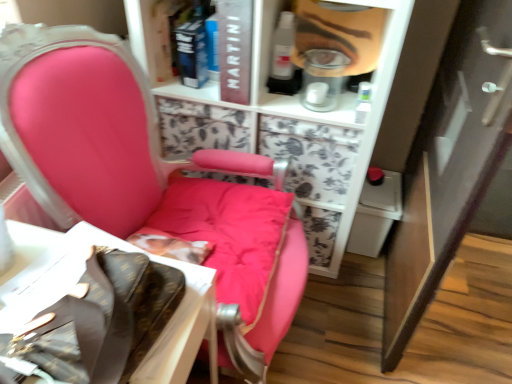
Based on the photo, in order to face hardcover book at upper center, the 2th book viewed from the right, should I rotate leftwards or rightwards?

You should rotate left by 6.574 degrees.

Describe the element at coordinates (449, 164) in the screenshot. I see `matte white cabinet at right` at that location.

Where is `white cardboard box at lower left`? This screenshot has width=512, height=384. white cardboard box at lower left is located at coordinates (103, 308).

In order to face matte pink chair at center, should I rotate leftwards or rightwards?

Turn left approximately 10.001 degrees to face it.

Locate an element on the screen. The width and height of the screenshot is (512, 384). matte pink chair at center is located at coordinates (93, 129).

In order to face matte black book at upper center, which appears as the 1th book when viewed from the right, should I rotate leftwards or rightwards?

Rotate your view left by about 1.300°.

Locate an element on the screen. The height and width of the screenshot is (384, 512). hardcover book at upper center, which is the first book from left to right is located at coordinates (192, 55).

Considering the sizes of objects white cardboard box at lower left and hardcover book at upper center, the 2th book viewed from the right, in the image provided, who is thinner, white cardboard box at lower left or hardcover book at upper center, the 2th book viewed from the right,?

hardcover book at upper center, the 2th book viewed from the right, is thinner.

Can you tell me how much white cardboard box at lower left and hardcover book at upper center, the 2th book viewed from the right, differ in facing direction?

91 degrees separate the facing orientations of white cardboard box at lower left and hardcover book at upper center, the 2th book viewed from the right.

Is white cardboard box at lower left positioned beyond the bounds of hardcover book at upper center, the 2th book viewed from the right?

Yes.

Considering the relative positions of white cardboard box at lower left and hardcover book at upper center, the 2th book viewed from the right, in the image provided, is white cardboard box at lower left to the left of hardcover book at upper center, the 2th book viewed from the right, from the viewer's perspective?

Yes.

From the image's perspective, count 1st books upward from the matte pink chair at center and point to it. Please provide its 2D coordinates.

[(234, 49)]

Does matte pink chair at center lie behind matte black book at upper center, which appears as the 1th book when viewed from the right?

No, the depth of matte pink chair at center is less than that of matte black book at upper center, which appears as the 1th book when viewed from the right.

From the image's perspective, would you say matte pink chair at center is shown under matte black book at upper center, which is the second book in left-to-right order?

Indeed, from the image's perspective, matte pink chair at center is shown beneath matte black book at upper center, which is the second book in left-to-right order.

Is matte pink chair at center bigger or smaller than matte black book at upper center, which is the second book in left-to-right order?

Clearly, matte pink chair at center is larger in size than matte black book at upper center, which is the second book in left-to-right order.

Is white cardboard box at lower left positioned far away from matte white cabinet at right?

No, white cardboard box at lower left is not far away from matte white cabinet at right.

Measure the distance between white cardboard box at lower left and matte white cabinet at right.

white cardboard box at lower left is 32.08 inches from matte white cabinet at right.

From the image's perspective, is white cardboard box at lower left located above or below matte white cabinet at right?

white cardboard box at lower left is situated lower than matte white cabinet at right in the image.

Between white cardboard box at lower left and matte white cabinet at right, which one appears on the left side from the viewer's perspective?

From the viewer's perspective, white cardboard box at lower left appears more on the left side.

Which of these two, matte plastic face at upper center or matte pink chair at center, is smaller?

matte plastic face at upper center is smaller.

From a real-world perspective, which is physically below, matte plastic face at upper center or matte pink chair at center?

matte pink chair at center.

Would you say matte plastic face at upper center is a long distance from matte pink chair at center?

matte plastic face at upper center is near matte pink chair at center, not far away.

Looking at their sizes, would you say matte plastic face at upper center is wider or thinner than matte pink chair at center?

In the image, matte plastic face at upper center appears to be more narrow than matte pink chair at center.

Does hardcover book at upper center, which is the first book from left to right, turn towards white cardboard box at lower left?

Yes, hardcover book at upper center, which is the first book from left to right, faces towards white cardboard box at lower left.

From a real-world perspective, relative to white cardboard box at lower left, is hardcover book at upper center, the 2th book viewed from the right, vertically above or below?

hardcover book at upper center, the 2th book viewed from the right, is situated higher than white cardboard box at lower left in the real world.

In order to click on table in front of the hardcover book at upper center, the 2th book viewed from the right in this screenshot , I will do `click(103, 308)`.

Looking at their sizes, would you say hardcover book at upper center, which is the first book from left to right, is wider or thinner than white cardboard box at lower left?

In the image, hardcover book at upper center, which is the first book from left to right, appears to be more narrow than white cardboard box at lower left.

Between white cardboard box at lower left and matte black book at upper center, which appears as the 1th book when viewed from the right, which one has less height?

Standing shorter between the two is matte black book at upper center, which appears as the 1th book when viewed from the right.

From the image's perspective, starting from the white cardboard box at lower left, which book is the 1st one above? Please provide its 2D coordinates.

[(234, 49)]

Is white cardboard box at lower left inside or outside of matte black book at upper center, which appears as the 1th book when viewed from the right?

The correct answer is: outside.

Is point (83, 229) less distant than point (220, 43)?

Yes, point (83, 229) is in front of point (220, 43).

At what (x,y) coordinates should I click in order to perform the action: click on table that appears on the left of matte plastic face at upper center. Please return your answer as a coordinate pair (x, y). The width and height of the screenshot is (512, 384). Looking at the image, I should click on (103, 308).

How different are the orientations of white cardboard box at lower left and matte plastic face at upper center in degrees?

The facing directions of white cardboard box at lower left and matte plastic face at upper center are 89 degrees apart.

Based on their sizes in the image, would you say white cardboard box at lower left is bigger or smaller than matte plastic face at upper center?

Considering their sizes, white cardboard box at lower left takes up more space than matte plastic face at upper center.

Which object is closer to the camera taking this photo, white cardboard box at lower left or matte plastic face at upper center?

Positioned in front is white cardboard box at lower left.

Where is `book that is the 1st one when counting rightward from the white cardboard box at lower left`? The image size is (512, 384). book that is the 1st one when counting rightward from the white cardboard box at lower left is located at coordinates (192, 55).

There is a matte pink chair at center. Identify the location of the 1st book above it (from the image's perspective). This screenshot has height=384, width=512. (234, 49).

Looking at the image, which one is located further to matte pink chair at center, hardcover book at upper center, which is the first book from left to right, or white cardboard box at lower left?

hardcover book at upper center, which is the first book from left to right, lies further to matte pink chair at center than the other object.

When comparing their distances from matte plastic face at upper center, does matte white cabinet at right or matte pink chair at center seem closer?

matte white cabinet at right is positioned closer to the anchor matte plastic face at upper center.

Considering their positions, is hardcover book at upper center, which is the first book from left to right, positioned closer to white cardboard box at lower left than matte pink chair at center?

matte pink chair at center is positioned closer to the anchor white cardboard box at lower left.

From the image, which object appears to be farther from matte pink chair at center, white cardboard box at lower left or matte black book at upper center, which appears as the 1th book when viewed from the right?

The object further to matte pink chair at center is matte black book at upper center, which appears as the 1th book when viewed from the right.

Considering their positions, is matte white cabinet at right positioned closer to matte black book at upper center, which appears as the 1th book when viewed from the right, than matte plastic face at upper center?

The object closer to matte black book at upper center, which appears as the 1th book when viewed from the right, is matte plastic face at upper center.

Looking at the image, which one is located closer to matte black book at upper center, which appears as the 1th book when viewed from the right, white cardboard box at lower left or hardcover book at upper center, the 2th book viewed from the right?

hardcover book at upper center, the 2th book viewed from the right, lies closer to matte black book at upper center, which appears as the 1th book when viewed from the right, than the other object.

Estimate the real-world distances between objects in this image. Which object is further from matte white cabinet at right, white cardboard box at lower left or hardcover book at upper center, which is the first book from left to right?

hardcover book at upper center, which is the first book from left to right, is further to matte white cabinet at right.

Estimate the real-world distances between objects in this image. Which object is further from hardcover book at upper center, the 2th book viewed from the right, matte white cabinet at right or white cardboard box at lower left?

white cardboard box at lower left lies further to hardcover book at upper center, the 2th book viewed from the right, than the other object.

Find the location of `chair between hardcover book at upper center, which is the first book from left to right, and white cardboard box at lower left, in the vertical direction`. chair between hardcover book at upper center, which is the first book from left to right, and white cardboard box at lower left, in the vertical direction is located at coordinates (93, 129).

What are the coordinates of `person situated between matte black book at upper center, which is the second book in left-to-right order, and matte white cabinet at right from left to right` in the screenshot? It's located at (339, 34).

The width and height of the screenshot is (512, 384). In order to click on book between hardcover book at upper center, which is the first book from left to right, and matte plastic face at upper center in this screenshot , I will do `click(234, 49)`.

I want to click on person between matte pink chair at center and matte white cabinet at right in the horizontal direction, so click(x=339, y=34).